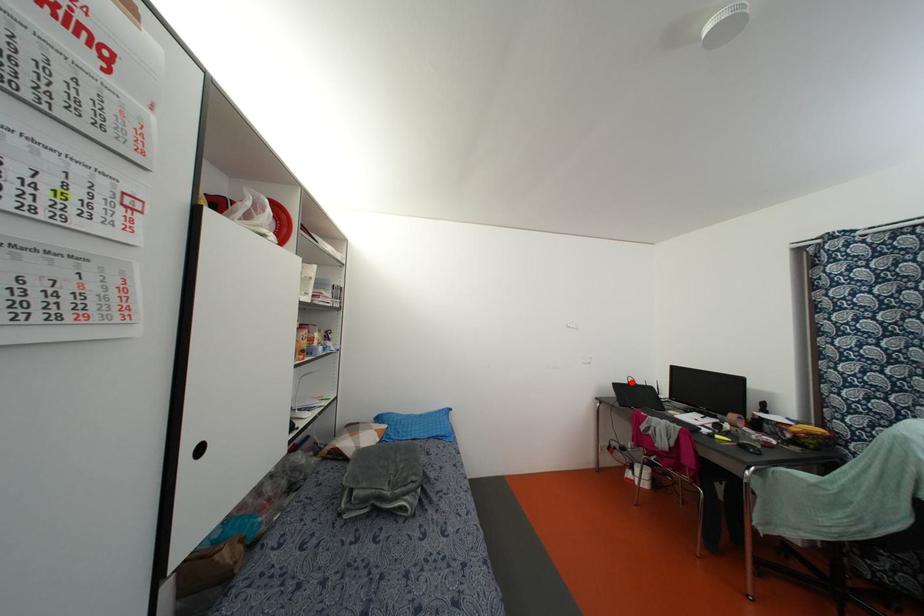
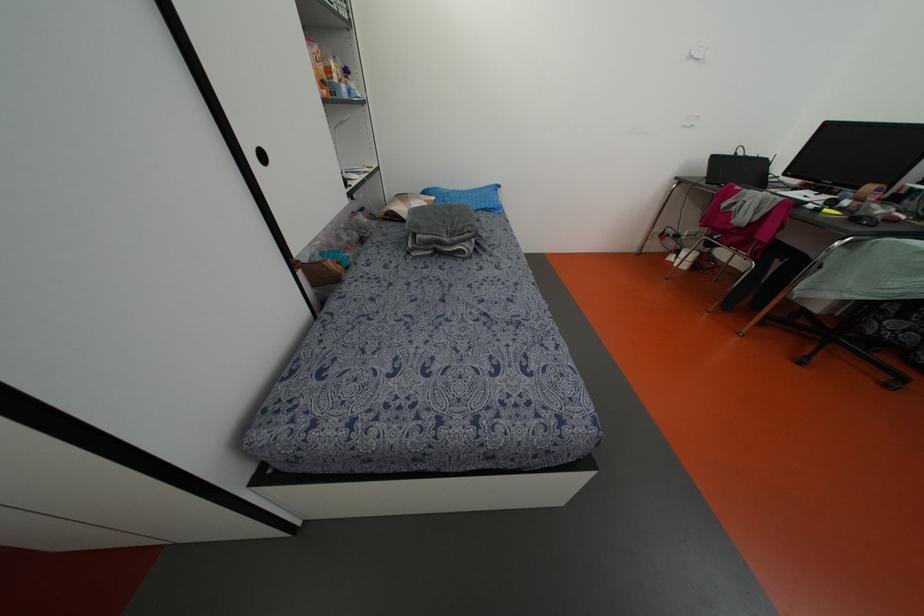
Find the pixel in the second image that matches the highlighted location in the first image.

(739, 153)